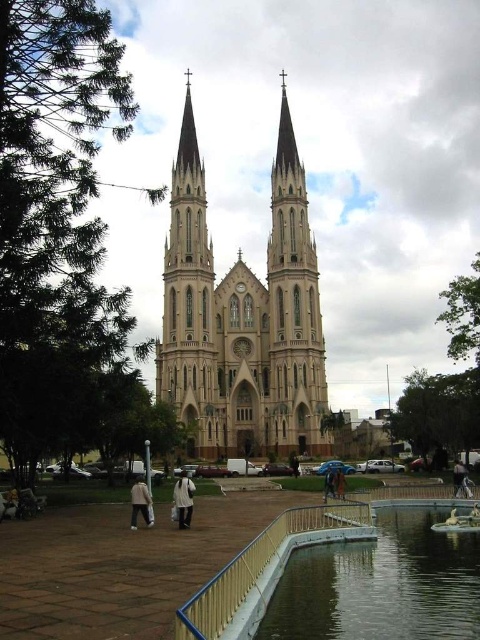
You are a tourist standing at the base of the smooth beige tower at center. You want to pick up the brown leather jacket at center. Is the jacket within a 30 meter radius from you?

The smooth beige tower at center and brown leather jacket at center are 36.11 meters apart from each other. Since 36.11 meters exceeds 30 meters, the jacket is outside the 30 meter radius, so you cannot reach it within that distance.

You are standing in front of the cathedral and notice a smooth beige tower at center and a brown leather jacket at center. Which object is positioned higher from the ground?

The smooth beige tower at center is above the brown leather jacket at center, so it is positioned higher from the ground.

Based on the photo, you are standing at the point marked by the coordinates point (147, 513). The cathedral spires are 89.40 meters away from you. Can you estimate how far the spires are from your current position?

The distance between you and the cathedral spires is 89.40 meters, so the spires are 89.40 meters away from your current position.